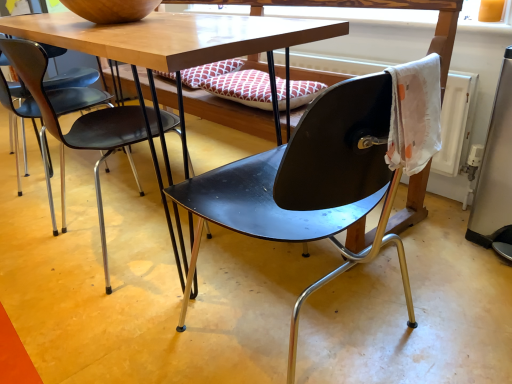
Question: From a real-world perspective, is matte black chair at center, the 2th chair in the right-to-left sequence, beneath matte black chair at center, which is counted as the first chair, starting from the right?

Choices:
 (A) yes
 (B) no

Answer: (A)

Question: Could you tell me if matte black chair at center, the 2th chair in the right-to-left sequence, is facing matte black chair at center, which is counted as the first chair, starting from the right?

Choices:
 (A) yes
 (B) no

Answer: (B)

Question: From the image's perspective, is matte black chair at center, acting as the 1th chair starting from the left, over matte black chair at center, which is counted as the first chair, starting from the right?

Choices:
 (A) no
 (B) yes

Answer: (B)

Question: Is matte black chair at center, the 2th chair in the right-to-left sequence, shorter than matte black chair at center, which is counted as the first chair, starting from the right?

Choices:
 (A) yes
 (B) no

Answer: (A)

Question: Does matte black chair at center, the 2th chair in the right-to-left sequence, have a larger size compared to matte black chair at center, which is counted as the first chair, starting from the right?

Choices:
 (A) yes
 (B) no

Answer: (B)

Question: Would you consider matte black chair at center, acting as the 1th chair starting from the left, to be distant from matte black chair at center, placed as the 2th chair when sorted from left to right?

Choices:
 (A) no
 (B) yes

Answer: (A)

Question: Can you confirm if matte black chair at center, which is counted as the first chair, starting from the right, is positioned to the left of matte black chair at center, acting as the 1th chair starting from the left?

Choices:
 (A) yes
 (B) no

Answer: (B)

Question: Would you consider matte black chair at center, which is counted as the first chair, starting from the right, to be distant from matte black chair at center, the 2th chair in the right-to-left sequence?

Choices:
 (A) no
 (B) yes

Answer: (A)

Question: Can you confirm if matte black chair at center, placed as the 2th chair when sorted from left to right, is bigger than matte black chair at center, the 2th chair in the right-to-left sequence?

Choices:
 (A) no
 (B) yes

Answer: (B)

Question: Is matte black chair at center, which is counted as the first chair, starting from the right, closer to camera compared to matte black chair at center, the 2th chair in the right-to-left sequence?

Choices:
 (A) yes
 (B) no

Answer: (A)

Question: From a real-world perspective, is matte black chair at center, which is counted as the first chair, starting from the right, on matte black chair at center, acting as the 1th chair starting from the left?

Choices:
 (A) no
 (B) yes

Answer: (B)

Question: Can you see matte black chair at center, which is counted as the first chair, starting from the right, touching matte black chair at center, the 2th chair in the right-to-left sequence?

Choices:
 (A) no
 (B) yes

Answer: (A)

Question: From the image's perspective, is matte black chair at center, which is counted as the first chair, starting from the right, located above or below matte black chair at center, the 2th chair in the right-to-left sequence?

Choices:
 (A) above
 (B) below

Answer: (B)